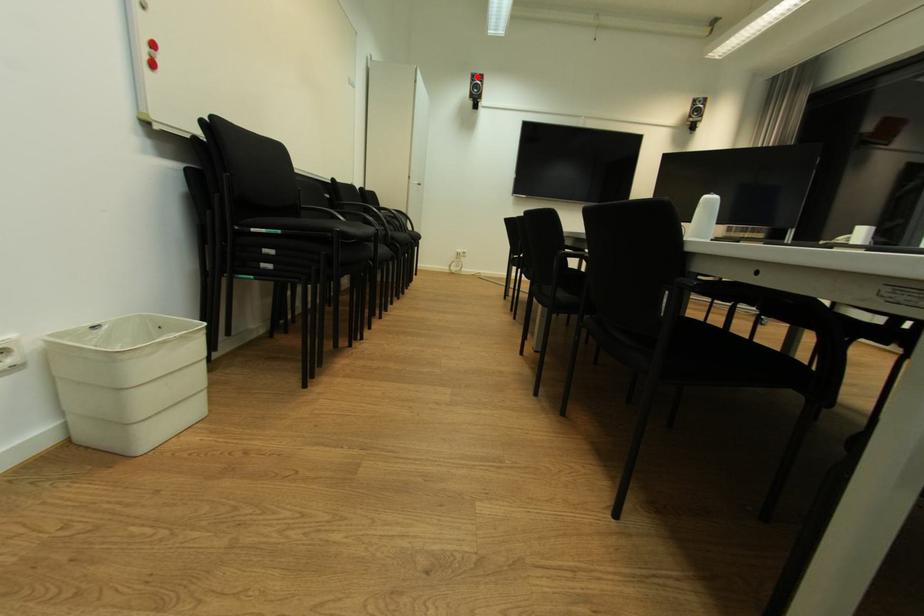
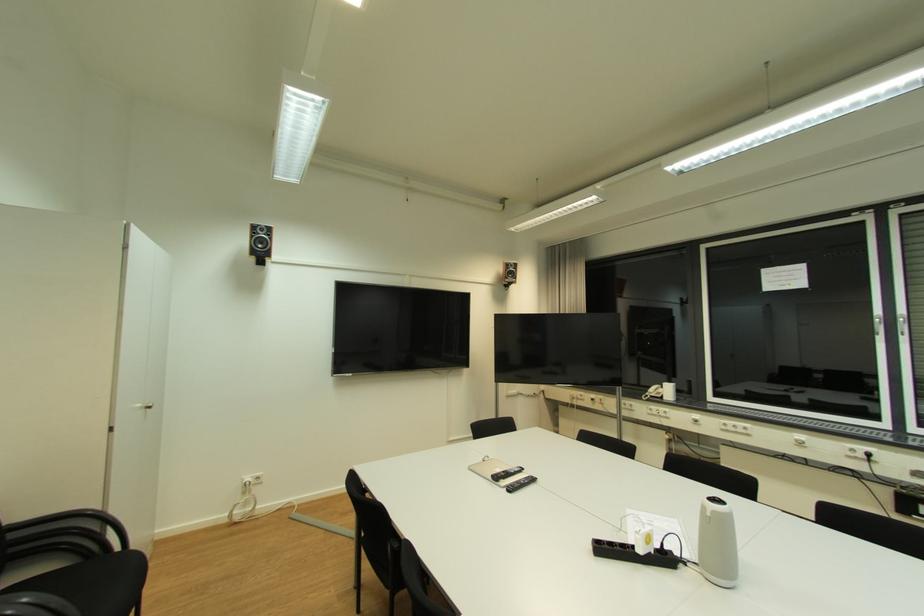
The point at the highlighted location is marked in the first image. Where is the corresponding point in the second image?

(261, 228)